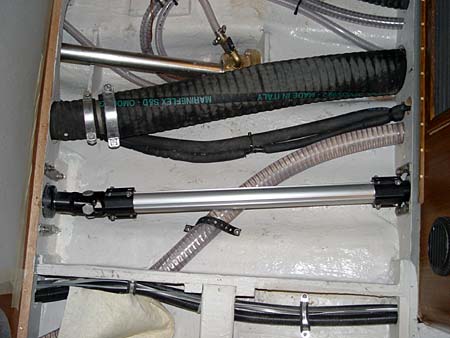
Where is `white cloth`? white cloth is located at coordinates 98,317.